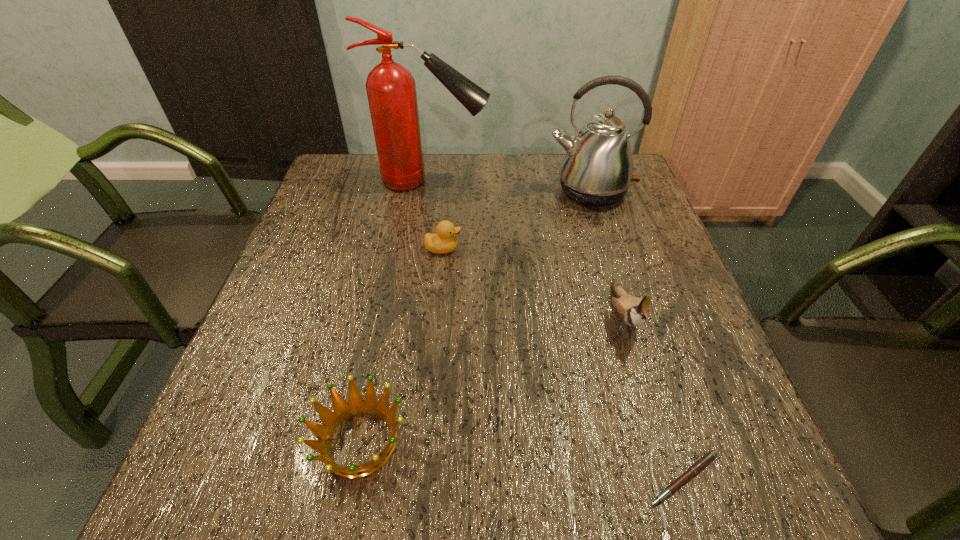
Identify the location of the tallest object. The height and width of the screenshot is (540, 960). (391, 89).

This screenshot has width=960, height=540. Identify the location of the fifth shortest object. (597, 170).

Where is `bird`? The image size is (960, 540). bird is located at coordinates (634, 311).

The width and height of the screenshot is (960, 540). Find the location of `the fourth shortest object`. the fourth shortest object is located at coordinates (634, 311).

Find the location of a particular element. the third farthest object is located at coordinates (444, 241).

I want to click on crown, so click(x=356, y=405).

Find the location of `pen`. pen is located at coordinates (706, 459).

Image resolution: width=960 pixels, height=540 pixels. I want to click on free space located at the nozzle end of the tallest object, so click(x=584, y=181).

Where is `vacant point located on the back of the kettle`? Image resolution: width=960 pixels, height=540 pixels. vacant point located on the back of the kettle is located at coordinates (579, 154).

Identify the location of vacant space located 0.250m at the face of the fourth shortest object. The width and height of the screenshot is (960, 540). (675, 492).